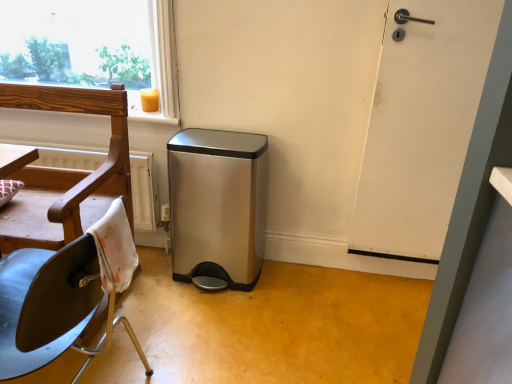
Question: Is satin steel trash can at center outside of white matte door at right?

Choices:
 (A) yes
 (B) no

Answer: (A)

Question: Does satin steel trash can at center have a lesser width compared to white matte door at right?

Choices:
 (A) no
 (B) yes

Answer: (A)

Question: Is satin steel trash can at center oriented towards white matte door at right?

Choices:
 (A) no
 (B) yes

Answer: (A)

Question: Is the depth of satin steel trash can at center greater than that of white matte door at right?

Choices:
 (A) no
 (B) yes

Answer: (B)

Question: Is there a large distance between satin steel trash can at center and white matte door at right?

Choices:
 (A) no
 (B) yes

Answer: (A)

Question: Is white matte door at right in front of or behind wooden chair at left in the image?

Choices:
 (A) front
 (B) behind

Answer: (B)

Question: Looking at the image, does white matte door at right seem bigger or smaller compared to wooden chair at left?

Choices:
 (A) big
 (B) small

Answer: (B)

Question: In terms of height, does white matte door at right look taller or shorter compared to wooden chair at left?

Choices:
 (A) short
 (B) tall

Answer: (B)

Question: From the image's perspective, is white matte door at right above or below wooden chair at left?

Choices:
 (A) below
 (B) above

Answer: (B)

Question: Looking at the image, does white matte door at right seem bigger or smaller compared to satin steel trash can at center?

Choices:
 (A) small
 (B) big

Answer: (A)

Question: From the image's perspective, relative to satin steel trash can at center, is white matte door at right above or below?

Choices:
 (A) below
 (B) above

Answer: (B)

Question: From a real-world perspective, is white matte door at right positioned above or below satin steel trash can at center?

Choices:
 (A) below
 (B) above

Answer: (B)

Question: Is white matte door at right wider or thinner than satin steel trash can at center?

Choices:
 (A) wide
 (B) thin

Answer: (B)

Question: Is satin steel trash can at center wider or thinner than wooden chair at left?

Choices:
 (A) wide
 (B) thin

Answer: (B)

Question: Looking at the image, does satin steel trash can at center seem bigger or smaller compared to wooden chair at left?

Choices:
 (A) small
 (B) big

Answer: (A)